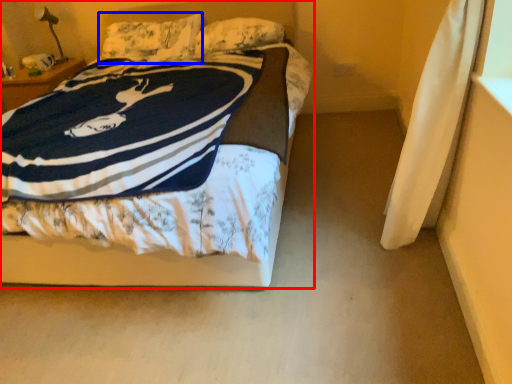
Question: Which point is closer to the camera, bed (highlighted by a red box) or pillow (highlighted by a blue box)?

Choices:
 (A) bed
 (B) pillow

Answer: (A)